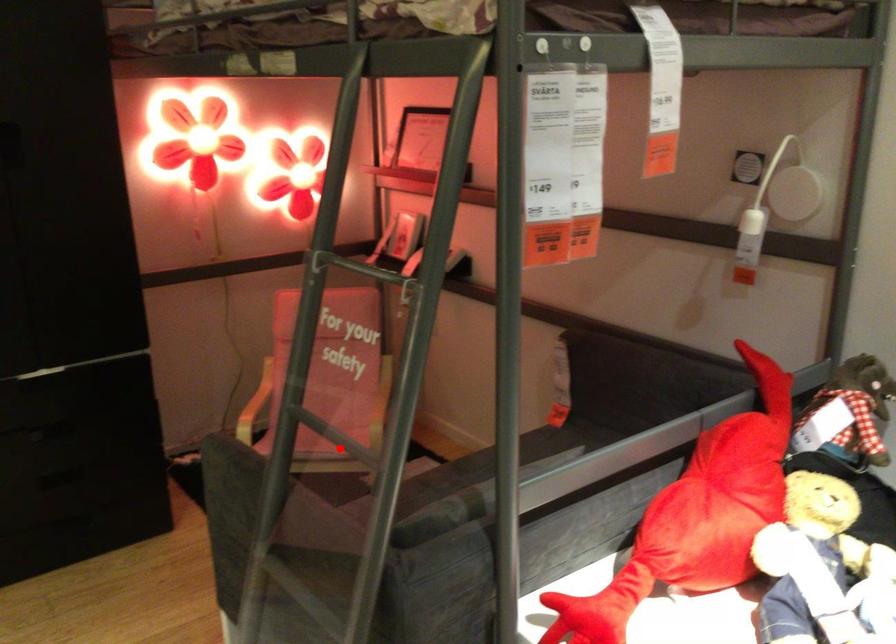
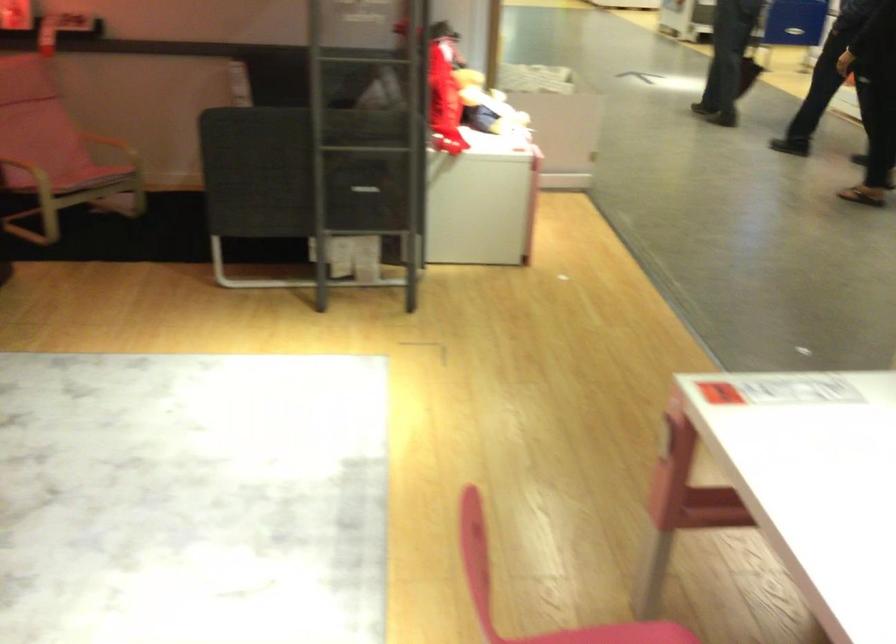
Question: I am providing you with two images of the same scene from different viewpoints. A red point is marked on the first image. Can you still see the location of the red point in image 2?

Choices:
 (A) Yes
 (B) No

Answer: (B)